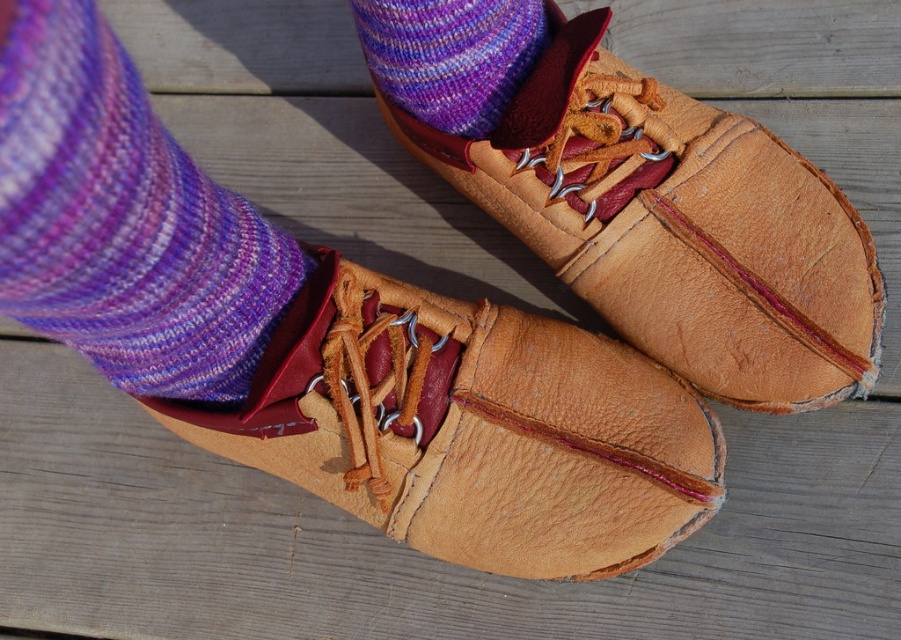
Question: In this image, where is purple knitted sock at lower left located relative to purple knitted sock at upper left?

Choices:
 (A) above
 (B) below

Answer: (B)

Question: Estimate the real-world distances between objects in this image. Which object is farther from the leather shoe at center?

Choices:
 (A) tan leather shoe at center
 (B) purple knitted sock at lower left
 (C) purple knitted sock at upper left

Answer: (B)

Question: Does tan leather shoe at center come behind purple knitted sock at lower left?

Choices:
 (A) no
 (B) yes

Answer: (B)

Question: Is tan leather shoe at center to the left of purple knitted sock at upper left from the viewer's perspective?

Choices:
 (A) yes
 (B) no

Answer: (A)

Question: Which object is the farthest from the tan leather shoe at center?

Choices:
 (A) leather shoe at center
 (B) purple knitted sock at lower left
 (C) purple knitted sock at upper left

Answer: (C)

Question: Which point appears farthest from the camera in this image?

Choices:
 (A) (371, 24)
 (B) (181, 307)
 (C) (297, 465)

Answer: (C)